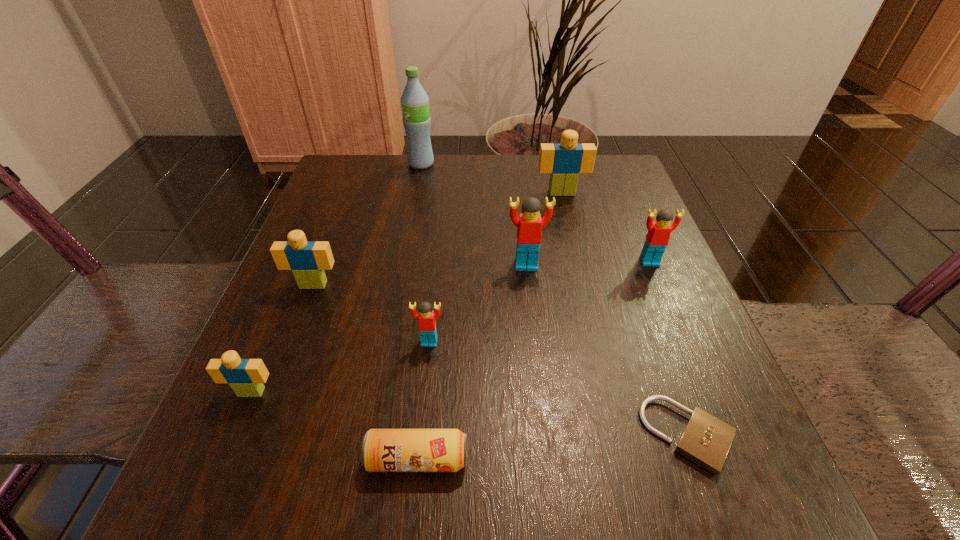
Identify the location of vacant space at the near right corner. [733, 483].

Find the location of a particular element. The height and width of the screenshot is (540, 960). free space between the farthest Lego and the nearest Lego is located at coordinates (406, 293).

Where is `unoccupied area between the nearest red Lego and the water bottle`? This screenshot has width=960, height=540. unoccupied area between the nearest red Lego and the water bottle is located at coordinates (425, 253).

Identify the location of vacant region between the shortest object and the green water bottle. This screenshot has height=540, width=960. (555, 300).

The width and height of the screenshot is (960, 540). In order to click on vacant space that's between the second shortest object and the third Lego from right to left in this screenshot , I will do `click(471, 362)`.

Identify the location of vacant region between the biggest beige Lego and the beige padlock. (x=625, y=314).

Identify the location of vacant point located between the second biggest red Lego and the second red Lego from left to right. (588, 263).

Where is `empty space that is in between the shortest object and the third Lego from left to right`? empty space that is in between the shortest object and the third Lego from left to right is located at coordinates (559, 388).

Where is `empty space that is in between the shortest object and the tallest object`? empty space that is in between the shortest object and the tallest object is located at coordinates (555, 300).

At what (x,y) coordinates should I click in order to perform the action: click on vacant space that's between the fourth Lego from left to right and the fourth nearest object. Please return your answer as a coordinate pair (x, y). Looking at the image, I should click on (478, 303).